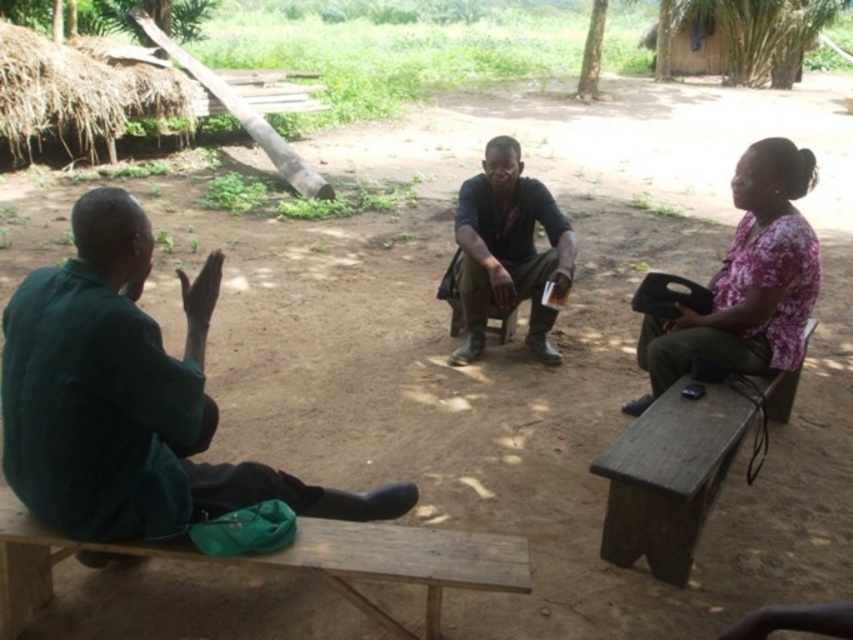
Question: Which point is closer to the camera taking this photo?

Choices:
 (A) (13, 589)
 (B) (503, 300)

Answer: (A)

Question: Estimate the real-world distances between objects in this image. Which object is farther from the brown wooden bench at right?

Choices:
 (A) green matte shirt at left
 (B) wooden bench at lower left

Answer: (A)

Question: Which object is positioned closest to the pink floral shirt at upper right?

Choices:
 (A) wooden bench at lower left
 (B) dark green fabric shirt at center
 (C) green matte shirt at left

Answer: (B)

Question: Does wooden bench at lower left have a larger size compared to dark green fabric shirt at center?

Choices:
 (A) no
 (B) yes

Answer: (A)

Question: Considering the relative positions of brown wooden bench at right and dark green fabric shirt at center in the image provided, where is brown wooden bench at right located with respect to dark green fabric shirt at center?

Choices:
 (A) below
 (B) above

Answer: (A)

Question: Does pink floral shirt at upper right appear over brown wooden bench at right?

Choices:
 (A) no
 (B) yes

Answer: (B)